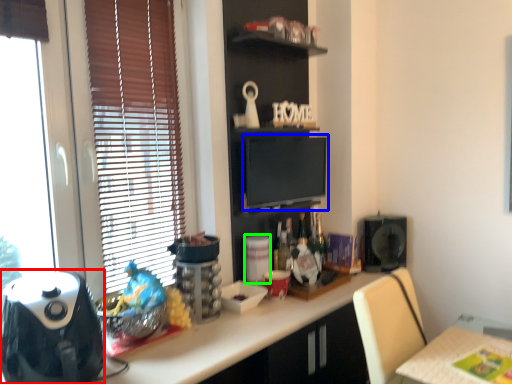
Question: Which is farther away from appliance (highlighted by a red box)? computer monitor (highlighted by a blue box) or appliance (highlighted by a green box)?

Choices:
 (A) computer monitor
 (B) appliance

Answer: (A)